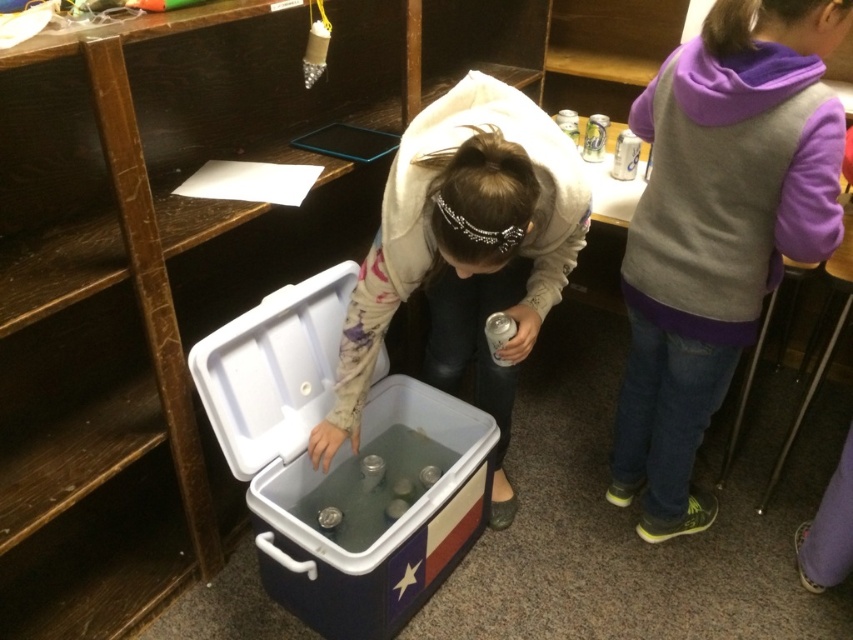
Which is more to the right, purple fleece vest at right or white plastic cooler at center?

Positioned to the right is purple fleece vest at right.

Can you confirm if purple fleece vest at right is taller than white plastic cooler at center?

Yes.

Locate an element on the screen. The width and height of the screenshot is (853, 640). purple fleece vest at right is located at coordinates (x=718, y=228).

Find the location of a particular element. Image resolution: width=853 pixels, height=640 pixels. purple fleece vest at right is located at coordinates (718, 228).

Which is more to the left, blue plastic cooler at center or white plastic cooler at center?

blue plastic cooler at center

Does point (260, 326) lie behind point (525, 188)?

Yes, point (260, 326) is farther from viewer.

Who is more forward, (x=299, y=308) or (x=343, y=428)?

Positioned in front is point (x=343, y=428).

Where is `blue plastic cooler at center`? The image size is (853, 640). blue plastic cooler at center is located at coordinates (340, 465).

Does purple fleece vest at right have a greater height compared to blue plastic cooler at center?

Yes, purple fleece vest at right is taller than blue plastic cooler at center.

Who is shorter, purple fleece vest at right or blue plastic cooler at center?

blue plastic cooler at center

Where is `purple fleece vest at right`? purple fleece vest at right is located at coordinates (718, 228).